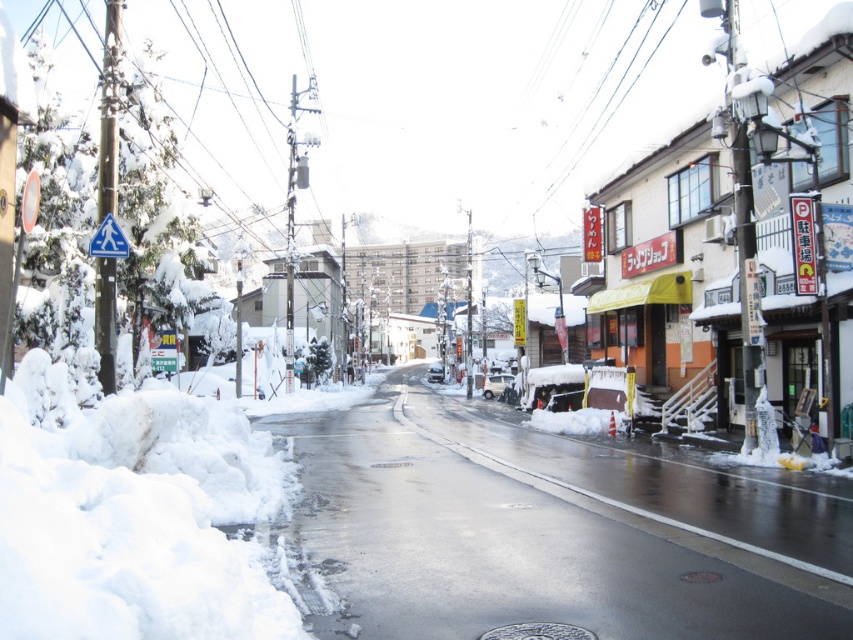
Looking at this image, you are standing at the point with coordinates point (705, 570) and want to walk to the point with coordinates point (282, 632). Given the snowy terrain, which direction should you face to move towards your destination?

You should face towards the direction of point (282, 632) because it is in front of point (705, 570) according to the spatial relationship provided.

You are a snowplow driver who needs to clear the snow from the street. You see the white fluffy snow at lower left and the silver metallic manhole cover at center. Which area requires more attention in terms of snow removal? Explain your reasoning based on their sizes.

The white fluffy snow at lower left requires more attention because its width is greater than the silver metallic manhole cover at center, indicating a larger area needing clearing.

You are a snowplow operator who needs to clear the snow from the street. You notice the white fluffy snow at lower left and the silver metallic manhole cover at center. Which area requires more snow removal effort based on their heights?

The white fluffy snow at lower left requires more snow removal effort because it has a greater height compared to the silver metallic manhole cover at center.